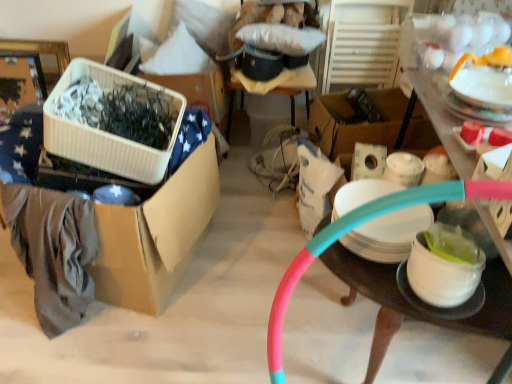
I want to click on pink rubber hoop at center, the 4th storage box positioned from the left, so click(495, 165).

Where is `pink rubber hoop at center, positioned as the 1th storage box in right-to-left order`? The height and width of the screenshot is (384, 512). pink rubber hoop at center, positioned as the 1th storage box in right-to-left order is located at coordinates (495, 165).

In the image, is cardboard box at left, the fourth storage box positioned from the right, positioned in front of or behind white ribbed plastic container at left, which is the third storage box in right-to-left order?

Visually, cardboard box at left, the fourth storage box positioned from the right, is located behind white ribbed plastic container at left, which is the third storage box in right-to-left order.

From the image's perspective, would you say cardboard box at left, arranged as the first storage box when viewed from the left, is shown under white ribbed plastic container at left, the second storage box viewed from the left?

Yes, from the image's perspective, cardboard box at left, arranged as the first storage box when viewed from the left, is below white ribbed plastic container at left, the second storage box viewed from the left.

Considering the relative sizes of cardboard box at left, the fourth storage box positioned from the right, and white ribbed plastic container at left, which is the third storage box in right-to-left order, in the image provided, is cardboard box at left, the fourth storage box positioned from the right, bigger than white ribbed plastic container at left, which is the third storage box in right-to-left order,?

Correct, cardboard box at left, the fourth storage box positioned from the right, is larger in size than white ribbed plastic container at left, which is the third storage box in right-to-left order.

From a real-world perspective, is cardboard box at left, arranged as the first storage box when viewed from the left, below white ribbed plastic container at left, which is the third storage box in right-to-left order?

Yes, from a real-world perspective, cardboard box at left, arranged as the first storage box when viewed from the left, is below white ribbed plastic container at left, which is the third storage box in right-to-left order.

Looking at this image, from the image's perspective, is cardboard box at left, arranged as the first storage box when viewed from the left, on top of white matte plate at right, which ranks as the 2th tableware in bottom-to-top order?

Indeed, from the image's perspective, cardboard box at left, arranged as the first storage box when viewed from the left, is shown above white matte plate at right, which ranks as the 2th tableware in bottom-to-top order.

Is cardboard box at left, the fourth storage box positioned from the right, in contact with white matte plate at right, which is the second tableware in top-to-bottom order?

No, cardboard box at left, the fourth storage box positioned from the right, is not in contact with white matte plate at right, which is the second tableware in top-to-bottom order.

In terms of height, does cardboard box at left, arranged as the first storage box when viewed from the left, look taller or shorter compared to white matte plate at right, which is the second tableware in top-to-bottom order?

Considering their sizes, cardboard box at left, arranged as the first storage box when viewed from the left, has more height than white matte plate at right, which is the second tableware in top-to-bottom order.

Does cardboard box at left, the fourth storage box positioned from the right, come in front of white matte plate at right, which ranks as the 2th tableware in bottom-to-top order?

No.

In terms of size, does cardboard box at left, arranged as the first storage box when viewed from the left, appear bigger or smaller than white glossy bowl at lower right, which is the 1th tableware from bottom to top?

Considering their sizes, cardboard box at left, arranged as the first storage box when viewed from the left, takes up more space than white glossy bowl at lower right, which is the 1th tableware from bottom to top.

Is cardboard box at left, arranged as the first storage box when viewed from the left, in contact with white glossy bowl at lower right, which is the 1th tableware from bottom to top?

cardboard box at left, arranged as the first storage box when viewed from the left, is not next to white glossy bowl at lower right, which is the 1th tableware from bottom to top, and they're not touching.

Which object is positioned more to the right, cardboard box at left, arranged as the first storage box when viewed from the left, or white glossy bowl at lower right, placed as the second tableware when sorted from left to right?

From the viewer's perspective, white glossy bowl at lower right, placed as the second tableware when sorted from left to right, appears more on the right side.

In the scene shown: From a real-world perspective, is cardboard box at left, the fourth storage box positioned from the right, positioned above or below white glossy bowl at lower right, which is the 1th tableware from bottom to top?

From a real-world perspective, cardboard box at left, the fourth storage box positioned from the right, is physically below white glossy bowl at lower right, which is the 1th tableware from bottom to top.

Between white ribbed plastic container at left, the second storage box viewed from the left, and pink rubber hose at right, which one has less height?

white ribbed plastic container at left, the second storage box viewed from the left.

Which is in front, white ribbed plastic container at left, which is the third storage box in right-to-left order, or pink rubber hose at right?

pink rubber hose at right.

Considering the relative sizes of white ribbed plastic container at left, the second storage box viewed from the left, and pink rubber hose at right in the image provided, is white ribbed plastic container at left, the second storage box viewed from the left, smaller than pink rubber hose at right?

Yes, white ribbed plastic container at left, the second storage box viewed from the left, is smaller than pink rubber hose at right.

The height and width of the screenshot is (384, 512). I want to click on tableware that is the 1st one when counting leftward from the pink rubber hose at right, so pyautogui.click(x=444, y=266).

Who is smaller, white glossy bowl at lower right, the second tableware viewed from the right, or pink rubber hose at right?

With smaller size is white glossy bowl at lower right, the second tableware viewed from the right.

From the image's perspective, is white glossy bowl at lower right, placed as the third tableware when sorted from top to bottom, on top of pink rubber hose at right?

Correct, white glossy bowl at lower right, placed as the third tableware when sorted from top to bottom, appears higher than pink rubber hose at right in the image.

Is white glossy bowl at lower right, placed as the third tableware when sorted from top to bottom, next to pink rubber hose at right?

No.

Which of these two, white glossy teapot at upper right, which is counted as the 1th tableware, starting from the right, or pink rubber hoop at center, positioned as the 1th storage box in right-to-left order, stands taller?

With more height is white glossy teapot at upper right, which is counted as the 1th tableware, starting from the right.

Considering the positions of objects white glossy teapot at upper right, marked as the third tableware in a left-to-right arrangement, and pink rubber hoop at center, the 4th storage box positioned from the left, in the image provided, who is more to the right, white glossy teapot at upper right, marked as the third tableware in a left-to-right arrangement, or pink rubber hoop at center, the 4th storage box positioned from the left,?

white glossy teapot at upper right, marked as the third tableware in a left-to-right arrangement.

From a real-world perspective, is white glossy teapot at upper right, which is counted as the 1th tableware, starting from the right, below pink rubber hoop at center, positioned as the 1th storage box in right-to-left order?

Incorrect, from a real-world perspective, white glossy teapot at upper right, which is counted as the 1th tableware, starting from the right, is higher than pink rubber hoop at center, positioned as the 1th storage box in right-to-left order.

Which of these two, white glossy teapot at upper right, the 3th tableware ordered from the bottom, or pink rubber hoop at center, the 4th storage box positioned from the left, is thinner?

white glossy teapot at upper right, the 3th tableware ordered from the bottom.

Looking at this image, is pink rubber hose at right located within pink rubber hoop at center, positioned as the 1th storage box in right-to-left order?

No, pink rubber hose at right is located outside of pink rubber hoop at center, positioned as the 1th storage box in right-to-left order.

Considering the positions of objects pink rubber hoop at center, positioned as the 1th storage box in right-to-left order, and pink rubber hose at right in the image provided, who is more to the left, pink rubber hoop at center, positioned as the 1th storage box in right-to-left order, or pink rubber hose at right?

pink rubber hose at right.

Is point (496, 150) farther from viewer compared to point (373, 361)?

That is False.

In the scene shown: Considering the relative sizes of pink rubber hoop at center, the 4th storage box positioned from the left, and pink rubber hose at right in the image provided, is pink rubber hoop at center, the 4th storage box positioned from the left, bigger than pink rubber hose at right?

No, pink rubber hoop at center, the 4th storage box positioned from the left, is not bigger than pink rubber hose at right.

Locate an element on the screen. This screenshot has width=512, height=384. the 2nd storage box above the cardboard box at left, arranged as the first storage box when viewed from the left (from the image's perspective) is located at coordinates (106, 132).

Locate an element on the screen. This screenshot has width=512, height=384. the 3rd storage box to the left when counting from the white matte plate at right, placed as the 1th tableware when sorted from left to right is located at coordinates (155, 236).

Which object lies nearer to the anchor point white matte plate at right, placed as the 1th tableware when sorted from left to right, white glossy bowl at lower right, the second tableware viewed from the right, or white glossy teapot at upper right, the 3th tableware ordered from the bottom?

Among the two, white glossy bowl at lower right, the second tableware viewed from the right, is located nearer to white matte plate at right, placed as the 1th tableware when sorted from left to right.

Based on their spatial positions, is pink rubber hose at right or white glossy bowl at lower right, placed as the third tableware when sorted from top to bottom, closer to cardboard box at left, the fourth storage box positioned from the right?

The object closer to cardboard box at left, the fourth storage box positioned from the right, is pink rubber hose at right.

Based on their spatial positions, is pink rubber hoop at center, positioned as the 1th storage box in right-to-left order, or white glossy bowl at lower right, the second tableware viewed from the right, closer to white plastic storage box at upper center, which is the 3th storage box from left to right?

white glossy bowl at lower right, the second tableware viewed from the right.

Considering their positions, is white glossy bowl at lower right, placed as the second tableware when sorted from left to right, positioned closer to pink rubber hose at right than white glossy teapot at upper right, marked as the 1th tableware in a top-to-bottom arrangement?

white glossy bowl at lower right, placed as the second tableware when sorted from left to right.

Looking at the image, which one is located closer to white glossy teapot at upper right, marked as the third tableware in a left-to-right arrangement, cardboard box at left, arranged as the first storage box when viewed from the left, or white plastic storage box at upper center, arranged as the second storage box when viewed from the right?

cardboard box at left, arranged as the first storage box when viewed from the left, lies closer to white glossy teapot at upper right, marked as the third tableware in a left-to-right arrangement, than the other object.

Looking at the image, which one is located closer to white plastic storage box at upper center, arranged as the second storage box when viewed from the right, white matte plate at right, acting as the third tableware starting from the right, or white glossy teapot at upper right, marked as the third tableware in a left-to-right arrangement?

white matte plate at right, acting as the third tableware starting from the right, is positioned closer to the anchor white plastic storage box at upper center, arranged as the second storage box when viewed from the right.

Based on their spatial positions, is white ribbed plastic container at left, the second storage box viewed from the left, or cardboard box at left, arranged as the first storage box when viewed from the left, further from white matte plate at right, acting as the third tableware starting from the right?

white ribbed plastic container at left, the second storage box viewed from the left.

Looking at the image, which one is located further to cardboard box at left, arranged as the first storage box when viewed from the left, pink rubber hose at right or pink rubber hoop at center, the 4th storage box positioned from the left?

pink rubber hoop at center, the 4th storage box positioned from the left.

I want to click on table between cardboard box at left, the fourth storage box positioned from the right, and pink rubber hoop at center, the 4th storage box positioned from the left, so click(411, 306).

Where is `tableware situated between white ribbed plastic container at left, which is the third storage box in right-to-left order, and white glossy bowl at lower right, which is the 1th tableware from bottom to top, from left to right`? Image resolution: width=512 pixels, height=384 pixels. tableware situated between white ribbed plastic container at left, which is the third storage box in right-to-left order, and white glossy bowl at lower right, which is the 1th tableware from bottom to top, from left to right is located at coordinates (388, 234).

Locate an element on the screen. storage box between white ribbed plastic container at left, which is the third storage box in right-to-left order, and pink rubber hose at right is located at coordinates (166, 75).

The image size is (512, 384). I want to click on tableware between cardboard box at left, the fourth storage box positioned from the right, and white glossy bowl at lower right, the second tableware viewed from the right, from left to right, so click(x=388, y=234).